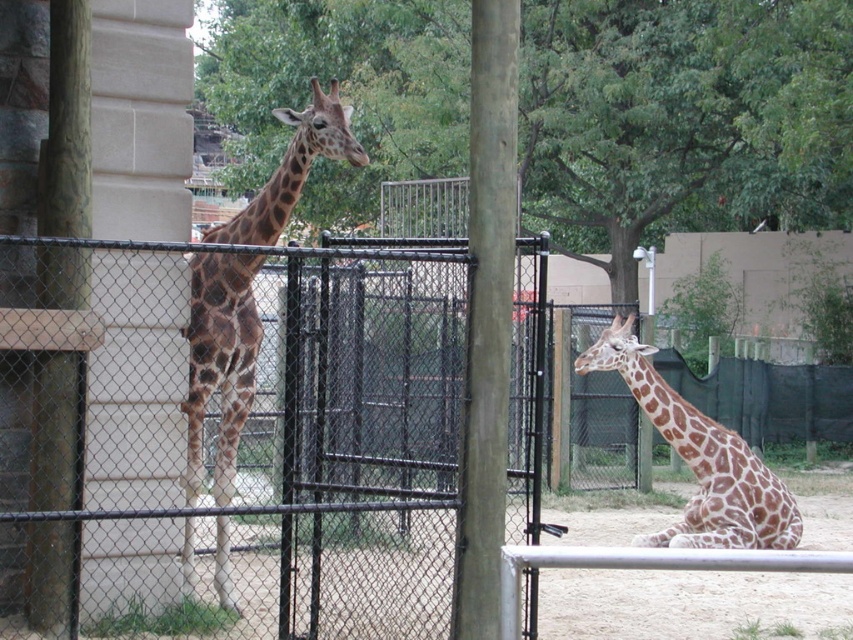
Describe the element at coordinates (682, 120) in the screenshot. I see `green leafy tree at upper center` at that location.

Between point (616, 116) and point (491, 202), which one is positioned in front?

Point (491, 202)

This screenshot has width=853, height=640. What are the coordinates of `green leafy tree at upper center` in the screenshot? It's located at (682, 120).

Measure the distance between green leafy tree at upper center and camera.

green leafy tree at upper center and camera are 69.03 feet apart from each other.

Find the location of `green leafy tree at upper center`. green leafy tree at upper center is located at coordinates (682, 120).

Is point (618, 93) behind point (173, 104)?

Yes.

You are a GUI agent. You are given a task and a screenshot of the screen. Output one action in this format:
    pyautogui.click(x=<x>, y=<y>)
    Task: Click on the green leafy tree at upper center
    Image resolution: width=853 pixels, height=640 pixels.
    Given the screenshot: What is the action you would take?
    pyautogui.click(x=682, y=120)

Is black chain-link fence at center closer to camera compared to smooth wood pole at center?

No, it is not.

Which is more to the right, black chain-link fence at center or smooth wood pole at center?

From the viewer's perspective, black chain-link fence at center appears more on the right side.

Which is behind, point (328, 467) or point (497, 60)?

The point (328, 467) is more distant.

You are a GUI agent. You are given a task and a screenshot of the screen. Output one action in this format:
    pyautogui.click(x=<x>, y=<y>)
    Task: Click on the black chain-link fence at center
    
    Given the screenshot: What is the action you would take?
    pyautogui.click(x=241, y=445)